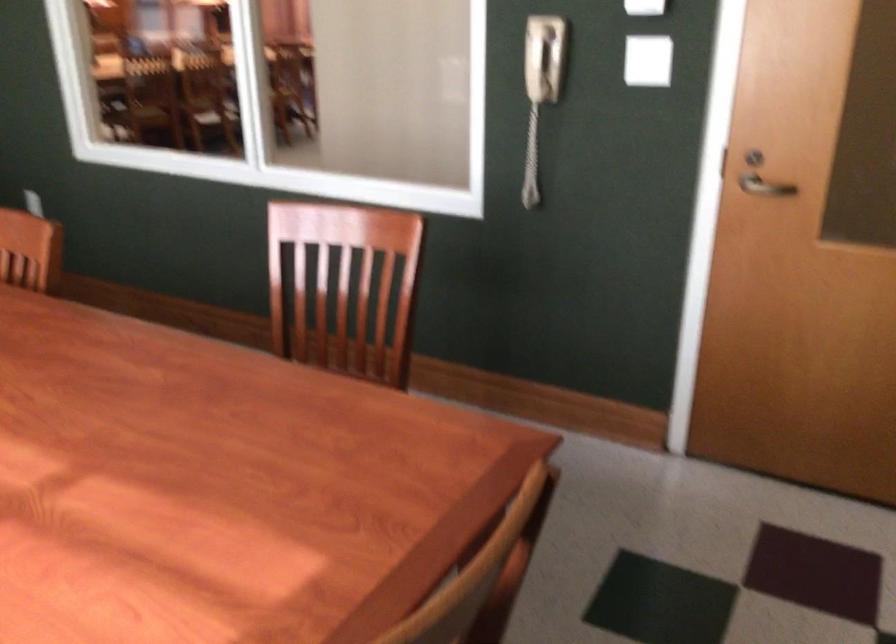
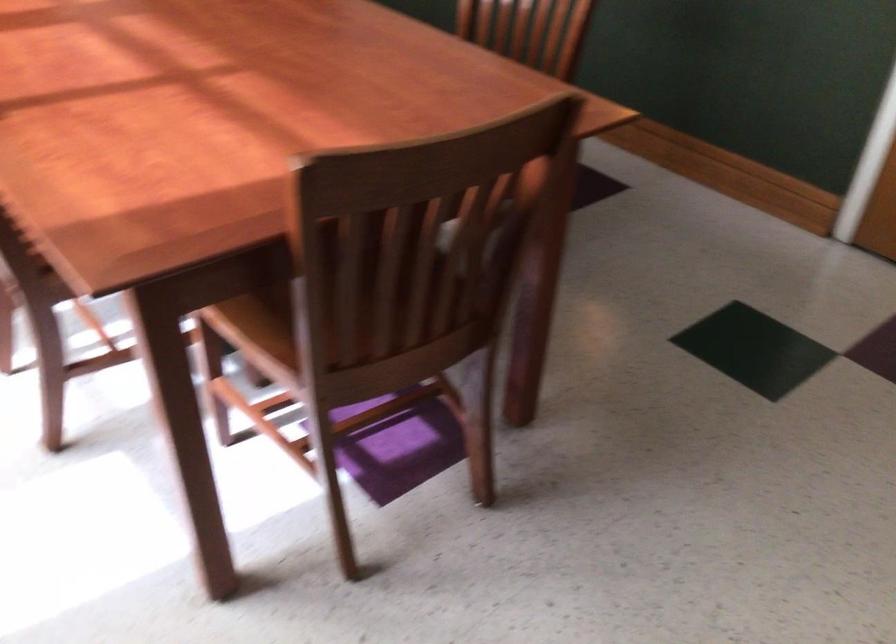
Question: Based on the continuous images, in which direction is the camera rotating? Reply with the corresponding letter.

Choices:
 (A) Left
 (B) Right
 (C) Up
 (D) Down

Answer: (D)